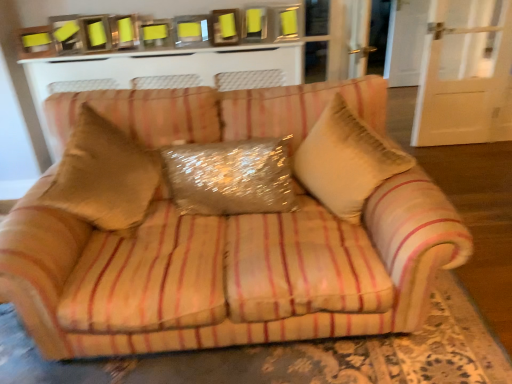
Question: Is beige striped fabric couch at center turned away from white textured cabinet at upper center?

Choices:
 (A) no
 (B) yes

Answer: (A)

Question: Is the position of beige striped fabric couch at center more distant than that of white textured cabinet at upper center?

Choices:
 (A) yes
 (B) no

Answer: (B)

Question: Can you confirm if beige striped fabric couch at center is taller than white textured cabinet at upper center?

Choices:
 (A) yes
 (B) no

Answer: (B)

Question: Is beige striped fabric couch at center completely or partially outside of white textured cabinet at upper center?

Choices:
 (A) no
 (B) yes

Answer: (B)

Question: From the image's perspective, is beige striped fabric couch at center over white textured cabinet at upper center?

Choices:
 (A) no
 (B) yes

Answer: (A)

Question: Is point (204, 221) closer or farther from the camera than point (353, 183)?

Choices:
 (A) farther
 (B) closer

Answer: (A)

Question: Considering the positions of beige striped fabric couch at center and beige textured pillow at center in the image, is beige striped fabric couch at center taller or shorter than beige textured pillow at center?

Choices:
 (A) tall
 (B) short

Answer: (B)

Question: In the image, is beige striped fabric couch at center on the left side or the right side of beige textured pillow at center?

Choices:
 (A) right
 (B) left

Answer: (B)

Question: From a real-world perspective, is beige striped fabric couch at center physically located above or below beige textured pillow at center?

Choices:
 (A) below
 (B) above

Answer: (A)

Question: From the image's perspective, is beige textured pillow at center positioned above or below beige striped fabric couch at center?

Choices:
 (A) above
 (B) below

Answer: (A)

Question: Is beige textured pillow at center wider or thinner than beige striped fabric couch at center?

Choices:
 (A) wide
 (B) thin

Answer: (B)

Question: Which is correct: beige textured pillow at center is inside beige striped fabric couch at center, or outside of it?

Choices:
 (A) outside
 (B) inside

Answer: (A)

Question: Relative to beige striped fabric couch at center, is beige textured pillow at center in front or behind?

Choices:
 (A) behind
 (B) front

Answer: (B)

Question: Based on their sizes in the image, would you say beige textured pillow at center is bigger or smaller than white textured cabinet at upper center?

Choices:
 (A) small
 (B) big

Answer: (A)

Question: Considering the positions of beige textured pillow at center and white textured cabinet at upper center in the image, is beige textured pillow at center wider or thinner than white textured cabinet at upper center?

Choices:
 (A) wide
 (B) thin

Answer: (A)